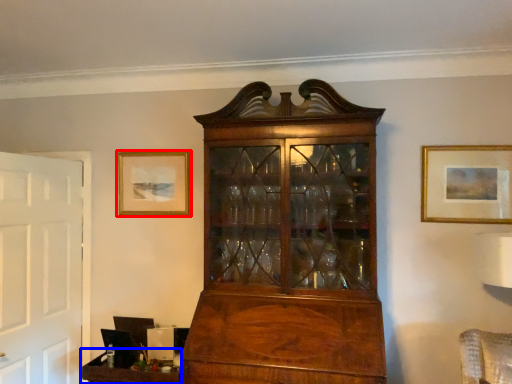
Question: Which object is further to the camera taking this photo, picture frame (highlighted by a red box) or table (highlighted by a blue box)?

Choices:
 (A) picture frame
 (B) table

Answer: (A)